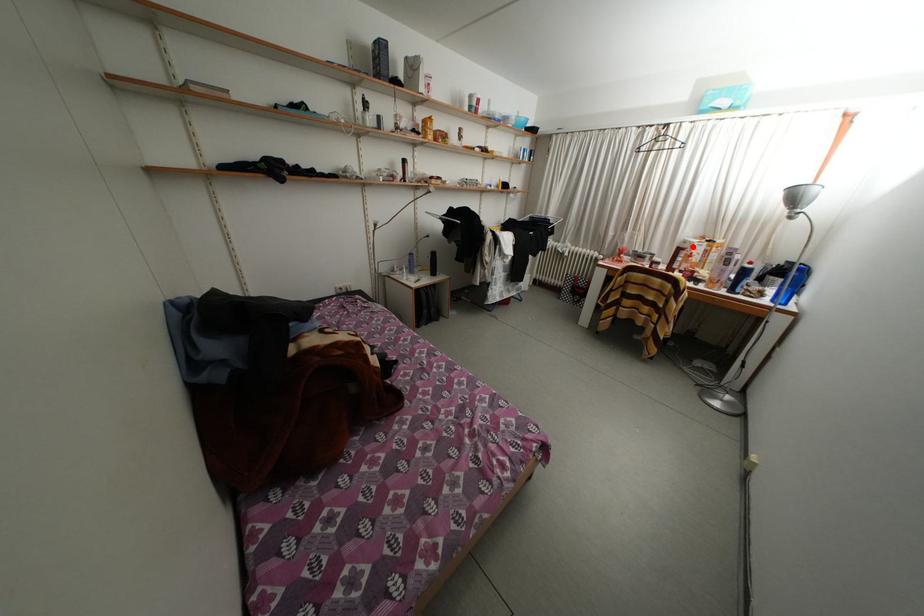
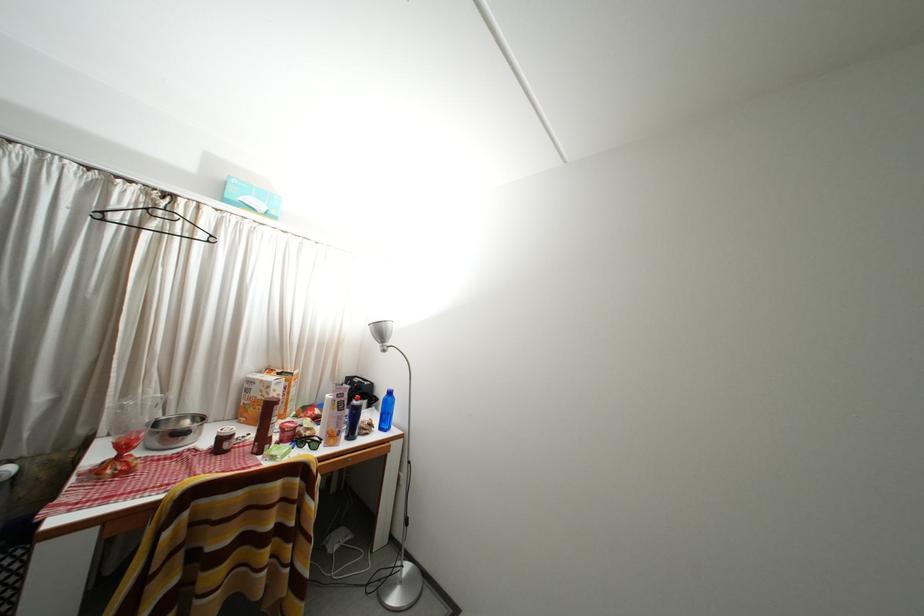
Locate, in the second image, the point that corresponds to the highlighted location in the first image.

(259, 387)